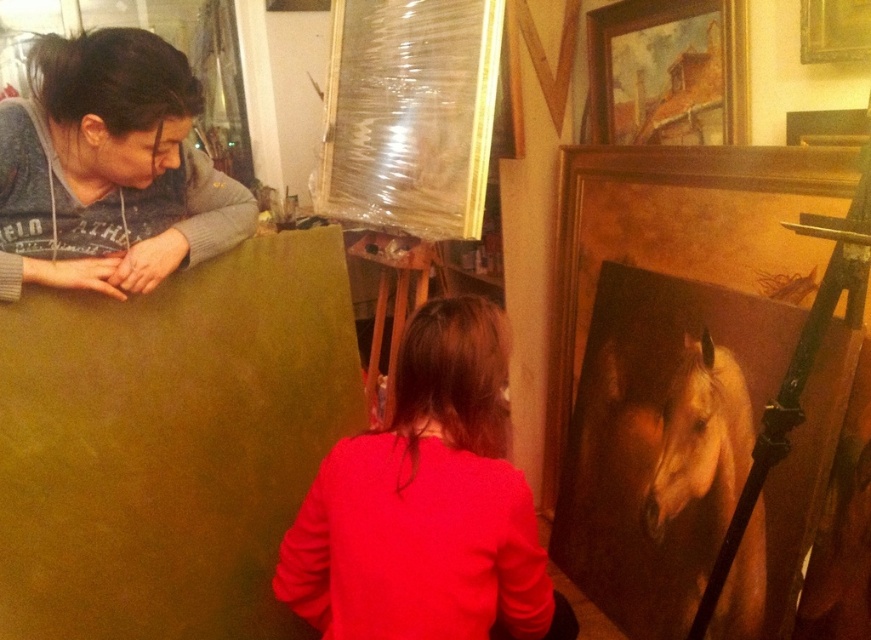
Question: Can you confirm if matte red sweater at center is positioned to the left of matte gray hoodie at upper left?

Choices:
 (A) yes
 (B) no

Answer: (B)

Question: Is matte red sweater at center to the right of matte gray hoodie at upper left from the viewer's perspective?

Choices:
 (A) yes
 (B) no

Answer: (A)

Question: Which object is farther from the camera taking this photo?

Choices:
 (A) matte red sweater at center
 (B) matte gray hoodie at upper left

Answer: (B)

Question: Which object is farther from the camera taking this photo?

Choices:
 (A) matte red sweater at center
 (B) matte gray hoodie at upper left

Answer: (B)

Question: Does matte red sweater at center appear over matte gray hoodie at upper left?

Choices:
 (A) no
 (B) yes

Answer: (A)

Question: Among these objects, which one is nearest to the camera?

Choices:
 (A) matte gray hoodie at upper left
 (B) matte red sweater at center

Answer: (B)